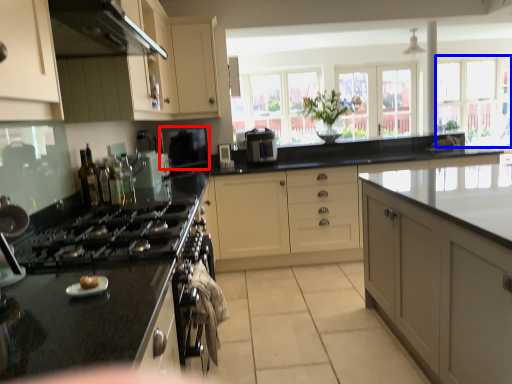
Question: Which object is further to the camera taking this photo, oven (highlighted by a red box) or window (highlighted by a blue box)?

Choices:
 (A) oven
 (B) window

Answer: (B)